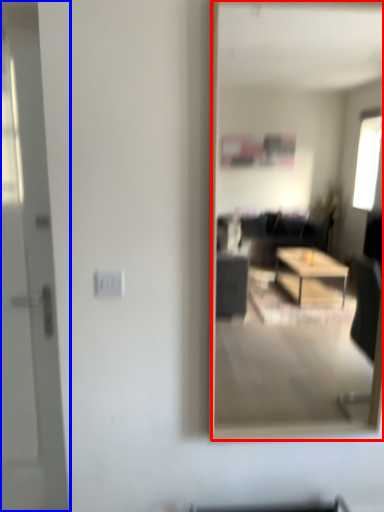
Question: Which point is closer to the camera, mirror (highlighted by a red box) or door (highlighted by a blue box)?

Choices:
 (A) mirror
 (B) door

Answer: (A)